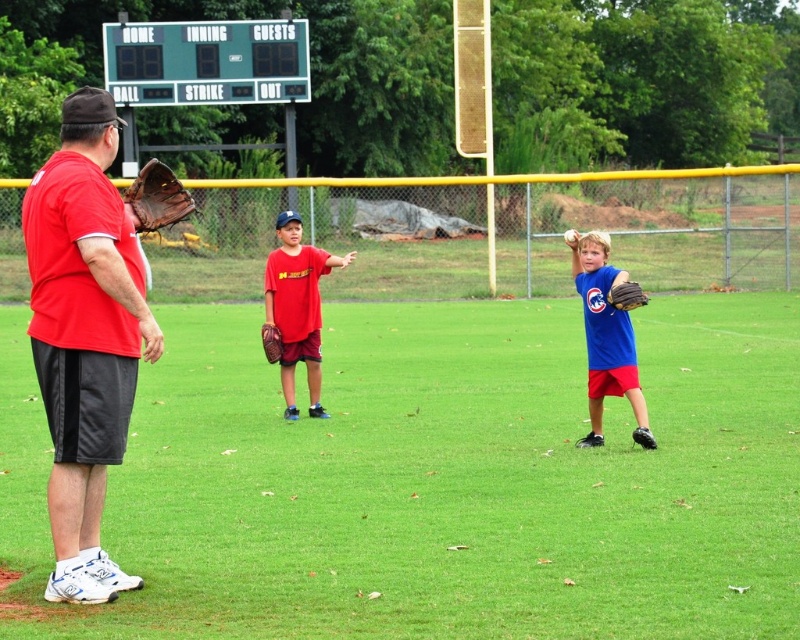
Question: Based on their relative distances, which object is farther from the blue matte baseball uniform at center?

Choices:
 (A) green plastic scoreboard at upper center
 (B) white matte baseball at center
 (C) blue matte jersey at center
 (D) matte red shirt at left

Answer: (A)

Question: Can you confirm if green grass at center is positioned below white matte baseball at center?

Choices:
 (A) no
 (B) yes

Answer: (B)

Question: Considering the relative positions of green grass at center and matte red shirt at left in the image provided, where is green grass at center located with respect to matte red shirt at left?

Choices:
 (A) below
 (B) above

Answer: (A)

Question: Is matte red shirt at left bigger than white matte baseball at center?

Choices:
 (A) yes
 (B) no

Answer: (B)

Question: Among these objects, which one is nearest to the camera?

Choices:
 (A) white matte baseball at center
 (B) green plastic scoreboard at upper center
 (C) blue matte jersey at center

Answer: (C)

Question: Which object is closer to the camera taking this photo?

Choices:
 (A) green grass at center
 (B) brown leather glove at right

Answer: (A)